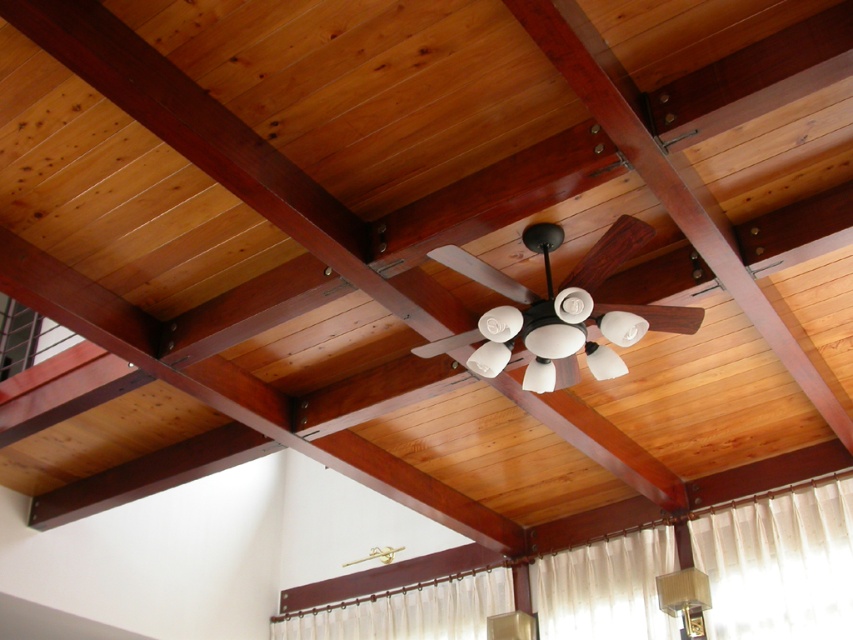
Who is taller, white sheer curtain at lower center or matte white lampshade at lower right?

With more height is white sheer curtain at lower center.

Between point (508, 577) and point (692, 608), which one is positioned in front?

Point (692, 608) is in front.

Identify the location of white sheer curtain at lower center. The image size is (853, 640). (408, 611).

Is the position of white matte fan at center more distant than that of matte white lampshade at lower right?

That is False.

Describe the element at coordinates (558, 310) in the screenshot. This screenshot has width=853, height=640. I see `white matte fan at center` at that location.

Identify the location of white matte fan at center. (558, 310).

Is white matte fan at center to the right of white sheer curtain at lower center from the viewer's perspective?

Yes, white matte fan at center is to the right of white sheer curtain at lower center.

Does white matte fan at center have a larger size compared to white sheer curtain at lower center?

Incorrect, white matte fan at center is not larger than white sheer curtain at lower center.

Which is in front, point (529, 298) or point (422, 609)?

Positioned in front is point (529, 298).

At what (x,y) coordinates should I click in order to perform the action: click on white matte fan at center. Please return your answer as a coordinate pair (x, y). The image size is (853, 640). Looking at the image, I should click on (558, 310).